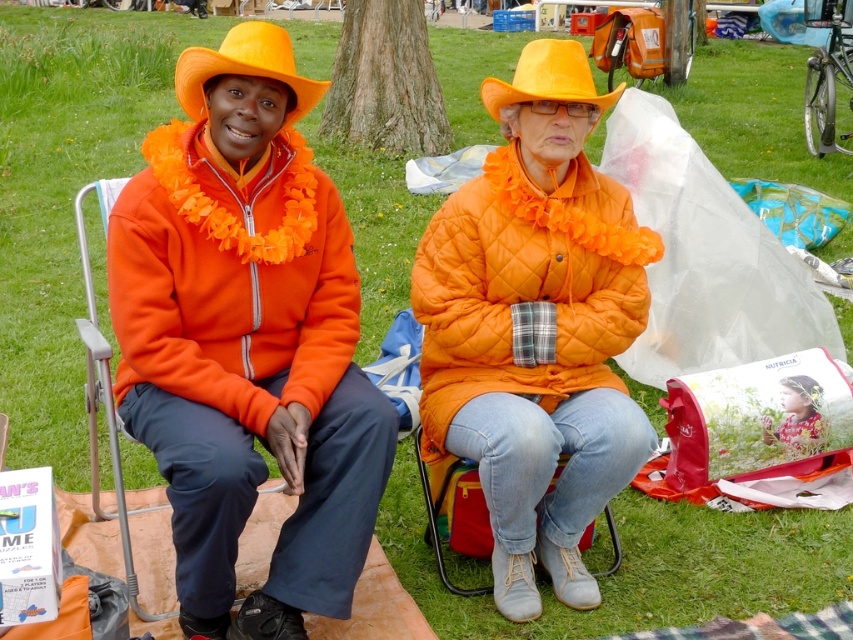
Consider the image. You are organizing a picnic and need to place a decorative hat on top of a fabric. Based on the image, can you confirm if the orange matte hat at center is already placed over the floral fabric at center?

Yes, the orange matte hat at center is positioned over floral fabric at center according to the image description.

You are taking a photo of two people sitting on a grassy park area. You want to focus on the person closer to the camera. Which of the two points, point (x=645, y=417) or point (x=801, y=394), should you aim your camera at to ensure the person is in focus?

Point (x=645, y=417) is closer to the camera than point (x=801, y=394), so you should aim your camera at point (x=645, y=417) to ensure the person is in focus.

You are standing in the park and see two points marked in the image. Which of the two points, point (558, 45) or point (820, 396), is closer to you?

Point (558, 45) is closer to the viewer than point (820, 396).